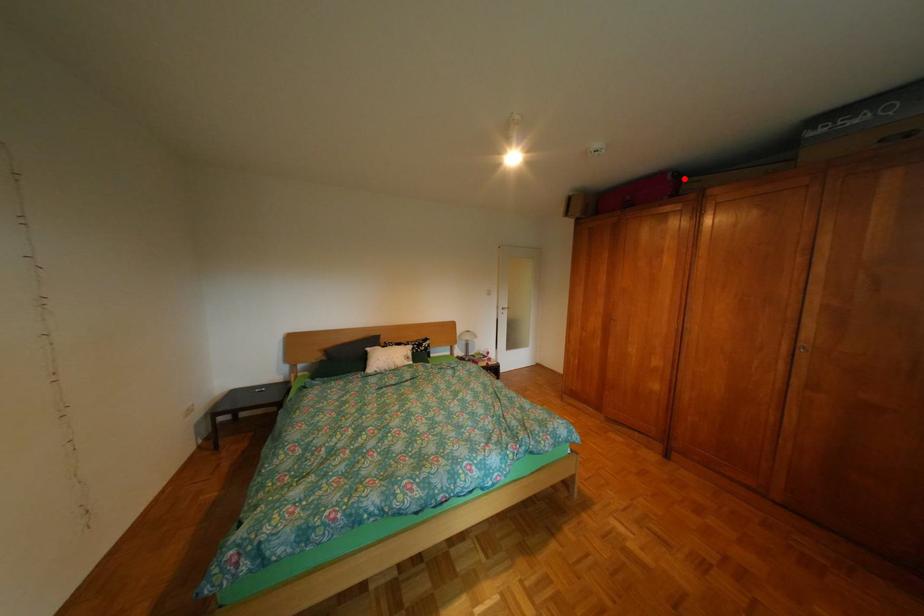
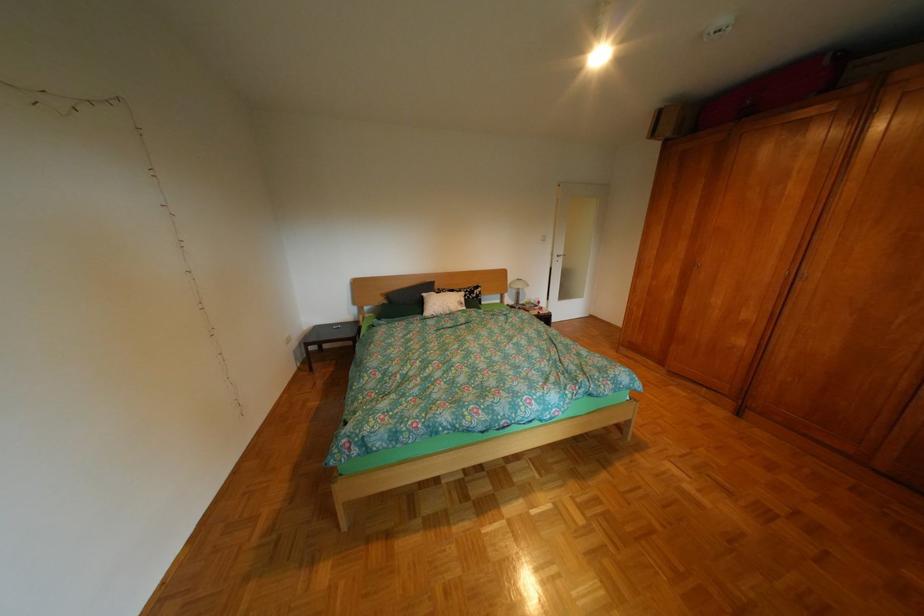
In the second image, find the point that corresponds to the highlighted location in the first image.

(842, 63)